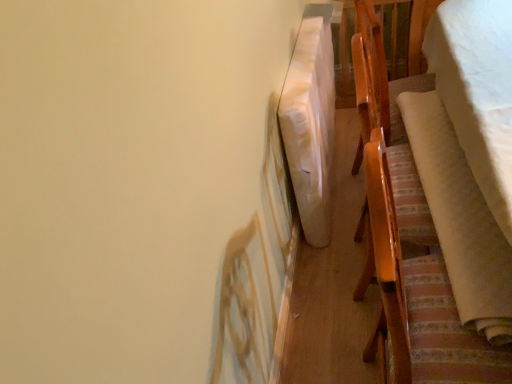
Where is `white soft blanket at right, acting as the 3th blanket starting from the left`? The height and width of the screenshot is (384, 512). white soft blanket at right, acting as the 3th blanket starting from the left is located at coordinates (478, 91).

Describe the element at coordinates (407, 239) in the screenshot. I see `wooden chair at right` at that location.

Locate an element on the screen. The image size is (512, 384). white fabric blanket at upper right, the 3th blanket viewed from the right is located at coordinates (310, 122).

Considering the sizes of white fabric blanket at upper right, which is the first blanket in left-to-right order, and wooden chair at right in the image, is white fabric blanket at upper right, which is the first blanket in left-to-right order, taller or shorter than wooden chair at right?

Considering their sizes, white fabric blanket at upper right, which is the first blanket in left-to-right order, has less height than wooden chair at right.

From the image's perspective, relative to wooden chair at right, is white fabric blanket at upper right, the 3th blanket viewed from the right, above or below?

white fabric blanket at upper right, the 3th blanket viewed from the right, is above wooden chair at right.

Is white fabric blanket at upper right, which is the first blanket in left-to-right order, outside of wooden chair at right?

That's correct, white fabric blanket at upper right, which is the first blanket in left-to-right order, is outside of wooden chair at right.

From a real-world perspective, relative to wooden chair at right, is white fabric blanket at upper right, which is the first blanket in left-to-right order, vertically above or below?

In terms of real-world spatial position, white fabric blanket at upper right, which is the first blanket in left-to-right order, is below wooden chair at right.

Considering the relative sizes of white soft blanket at right, acting as the 3th blanket starting from the left, and white soft blanket at right, the second blanket when ordered from left to right, in the image provided, is white soft blanket at right, acting as the 3th blanket starting from the left, thinner than white soft blanket at right, the second blanket when ordered from left to right,?

No, white soft blanket at right, acting as the 3th blanket starting from the left, is not thinner than white soft blanket at right, the second blanket when ordered from left to right.

Is white soft blanket at right, acting as the 3th blanket starting from the left, completely or partially outside of white soft blanket at right, which ranks as the 2th blanket in right-to-left order?

white soft blanket at right, acting as the 3th blanket starting from the left, is positioned outside white soft blanket at right, which ranks as the 2th blanket in right-to-left order.

Does white soft blanket at right, the 1th blanket positioned from the right, turn towards white soft blanket at right, which ranks as the 2th blanket in right-to-left order?

No, white soft blanket at right, the 1th blanket positioned from the right, is not facing towards white soft blanket at right, which ranks as the 2th blanket in right-to-left order.

Which object is further away from the camera, white soft blanket at right, the 1th blanket positioned from the right, or white soft blanket at right, which ranks as the 2th blanket in right-to-left order?

white soft blanket at right, which ranks as the 2th blanket in right-to-left order, is more distant.

Does point (306, 141) appear closer or farther from the camera than point (484, 124)?

Point (306, 141).

Which of these two, white fabric blanket at upper right, the 3th blanket viewed from the right, or white soft blanket at right, the 1th blanket positioned from the right, stands taller?

white soft blanket at right, the 1th blanket positioned from the right, is taller.

Is white fabric blanket at upper right, the 3th blanket viewed from the right, situated inside white soft blanket at right, the 1th blanket positioned from the right, or outside?

white fabric blanket at upper right, the 3th blanket viewed from the right, is outside white soft blanket at right, the 1th blanket positioned from the right.

From the picture: Who is bigger, wooden chair at right or white fabric blanket at upper right, which is the first blanket in left-to-right order?

With larger size is wooden chair at right.

You are a GUI agent. You are given a task and a screenshot of the screen. Output one action in this format:
    pyautogui.click(x=<x>, y=<y>)
    Task: Click on the blanket on the left of wooden chair at right
    This screenshot has height=384, width=512.
    Given the screenshot: What is the action you would take?
    pyautogui.click(x=310, y=122)

Is point (362, 92) closer or farther from the camera than point (325, 214)?

Clearly, point (362, 92) is closer to the camera than point (325, 214).

Is white soft blanket at right, the 1th blanket positioned from the right, inside or outside of white fabric blanket at upper right, which is the first blanket in left-to-right order?

white soft blanket at right, the 1th blanket positioned from the right, cannot be found inside white fabric blanket at upper right, which is the first blanket in left-to-right order.

Is white soft blanket at right, acting as the 3th blanket starting from the left, facing away from white fabric blanket at upper right, which is the first blanket in left-to-right order?

No, white soft blanket at right, acting as the 3th blanket starting from the left, is not facing away from white fabric blanket at upper right, which is the first blanket in left-to-right order.

Considering the relative sizes of white soft blanket at right, acting as the 3th blanket starting from the left, and white fabric blanket at upper right, which is the first blanket in left-to-right order, in the image provided, is white soft blanket at right, acting as the 3th blanket starting from the left, taller than white fabric blanket at upper right, which is the first blanket in left-to-right order,?

Indeed, white soft blanket at right, acting as the 3th blanket starting from the left, has a greater height compared to white fabric blanket at upper right, which is the first blanket in left-to-right order.

Is white soft blanket at right, the 1th blanket positioned from the right, to the right of white fabric blanket at upper right, which is the first blanket in left-to-right order, from the viewer's perspective?

Indeed, white soft blanket at right, the 1th blanket positioned from the right, is positioned on the right side of white fabric blanket at upper right, which is the first blanket in left-to-right order.

From the image's perspective, is white soft blanket at right, the 1th blanket positioned from the right, located above or below wooden chair at right?

From the image's perspective, white soft blanket at right, the 1th blanket positioned from the right, appears above wooden chair at right.

Which object is closer to the camera, white soft blanket at right, the 1th blanket positioned from the right, or wooden chair at right?

white soft blanket at right, the 1th blanket positioned from the right, is more forward.

Considering the sizes of objects white soft blanket at right, the 1th blanket positioned from the right, and wooden chair at right in the image provided, who is shorter, white soft blanket at right, the 1th blanket positioned from the right, or wooden chair at right?

Standing shorter between the two is white soft blanket at right, the 1th blanket positioned from the right.

Would you say white soft blanket at right, the 1th blanket positioned from the right, is inside or outside wooden chair at right?

white soft blanket at right, the 1th blanket positioned from the right, is not enclosed by wooden chair at right.

From the image's perspective, which is above, wooden chair at right or white soft blanket at right, acting as the 3th blanket starting from the left?

white soft blanket at right, acting as the 3th blanket starting from the left.

Which is behind, wooden chair at right or white soft blanket at right, the 1th blanket positioned from the right?

Positioned behind is wooden chair at right.

Between wooden chair at right and white soft blanket at right, the 1th blanket positioned from the right, which one appears on the right side from the viewer's perspective?

white soft blanket at right, the 1th blanket positioned from the right.

Where is `furniture above the white fabric blanket at upper right, the 3th blanket viewed from the right (from a real-world perspective)`? The image size is (512, 384). furniture above the white fabric blanket at upper right, the 3th blanket viewed from the right (from a real-world perspective) is located at coordinates (407, 239).

Locate an element on the screen. The height and width of the screenshot is (384, 512). the 1st blanket located beneath the white soft blanket at right, which ranks as the 2th blanket in right-to-left order (from a real-world perspective) is located at coordinates (478, 91).

Which object lies nearer to the anchor point white soft blanket at right, the 1th blanket positioned from the right, wooden chair at right or white fabric blanket at upper right, which is the first blanket in left-to-right order?

The object closer to white soft blanket at right, the 1th blanket positioned from the right, is wooden chair at right.

Estimate the real-world distances between objects in this image. Which object is closer to white soft blanket at right, the 1th blanket positioned from the right, white fabric blanket at upper right, which is the first blanket in left-to-right order, or wooden chair at right?

wooden chair at right is positioned closer to the anchor white soft blanket at right, the 1th blanket positioned from the right.

Looking at the image, which one is located further to white soft blanket at right, acting as the 3th blanket starting from the left, white soft blanket at right, the second blanket when ordered from left to right, or white fabric blanket at upper right, which is the first blanket in left-to-right order?

white fabric blanket at upper right, which is the first blanket in left-to-right order, is further to white soft blanket at right, acting as the 3th blanket starting from the left.

Looking at the image, which one is located closer to white fabric blanket at upper right, which is the first blanket in left-to-right order, wooden chair at right or white soft blanket at right, the second blanket when ordered from left to right?

wooden chair at right lies closer to white fabric blanket at upper right, which is the first blanket in left-to-right order, than the other object.

Looking at the image, which one is located further to white soft blanket at right, the 1th blanket positioned from the right, white soft blanket at right, the second blanket when ordered from left to right, or wooden chair at right?

The object further to white soft blanket at right, the 1th blanket positioned from the right, is wooden chair at right.

Which object lies nearer to the anchor point white fabric blanket at upper right, which is the first blanket in left-to-right order, white soft blanket at right, the 1th blanket positioned from the right, or white soft blanket at right, the second blanket when ordered from left to right?

white soft blanket at right, the second blanket when ordered from left to right.

Estimate the real-world distances between objects in this image. Which object is closer to white fabric blanket at upper right, the 3th blanket viewed from the right, white soft blanket at right, which ranks as the 2th blanket in right-to-left order, or white soft blanket at right, acting as the 3th blanket starting from the left?

white soft blanket at right, which ranks as the 2th blanket in right-to-left order.

Estimate the real-world distances between objects in this image. Which object is further from white soft blanket at right, the 1th blanket positioned from the right, white fabric blanket at upper right, the 3th blanket viewed from the right, or white soft blanket at right, which ranks as the 2th blanket in right-to-left order?

Among the two, white fabric blanket at upper right, the 3th blanket viewed from the right, is located further to white soft blanket at right, the 1th blanket positioned from the right.

Where is `furniture between white soft blanket at right, acting as the 3th blanket starting from the left, and white fabric blanket at upper right, which is the first blanket in left-to-right order, from front to back`? The image size is (512, 384). furniture between white soft blanket at right, acting as the 3th blanket starting from the left, and white fabric blanket at upper right, which is the first blanket in left-to-right order, from front to back is located at coordinates (407, 239).

Where is `furniture located between white soft blanket at right, which ranks as the 2th blanket in right-to-left order, and white fabric blanket at upper right, which is the first blanket in left-to-right order, in the depth direction`? Image resolution: width=512 pixels, height=384 pixels. furniture located between white soft blanket at right, which ranks as the 2th blanket in right-to-left order, and white fabric blanket at upper right, which is the first blanket in left-to-right order, in the depth direction is located at coordinates (407, 239).

Where is `blanket located between wooden chair at right and white soft blanket at right, acting as the 3th blanket starting from the left, in the left-right direction`? The height and width of the screenshot is (384, 512). blanket located between wooden chair at right and white soft blanket at right, acting as the 3th blanket starting from the left, in the left-right direction is located at coordinates (460, 219).

You are a GUI agent. You are given a task and a screenshot of the screen. Output one action in this format:
    pyautogui.click(x=<x>, y=<y>)
    Task: Click on the blanket located between white soft blanket at right, acting as the 3th blanket starting from the left, and white fabric blanket at upper right, the 3th blanket viewed from the right, in the depth direction
    Image resolution: width=512 pixels, height=384 pixels.
    Given the screenshot: What is the action you would take?
    click(x=460, y=219)